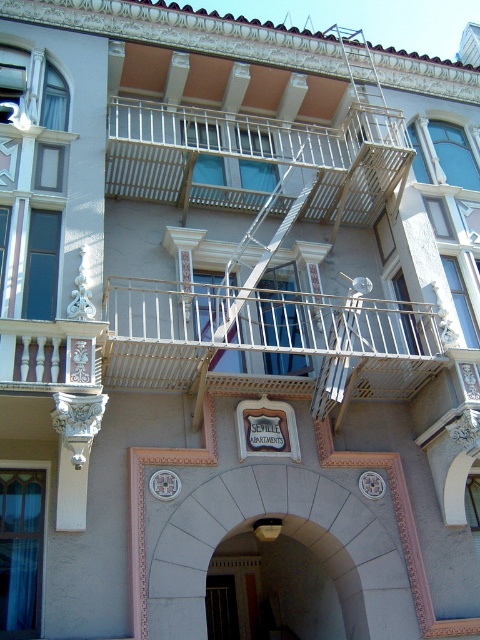
Between white metal railing at center and white metal railing at upper center, which one has more height?

Standing taller between the two is white metal railing at upper center.

Which is more to the left, white metal railing at center or white metal railing at upper center?

From the viewer's perspective, white metal railing at upper center appears more on the left side.

This screenshot has width=480, height=640. Find the location of `white metal railing at center`. white metal railing at center is located at coordinates (265, 337).

You are a GUI agent. You are given a task and a screenshot of the screen. Output one action in this format:
    pyautogui.click(x=<x>, y=<y>)
    Task: Click on the white metal railing at center
    The width and height of the screenshot is (480, 640).
    Given the screenshot: What is the action you would take?
    pyautogui.click(x=265, y=337)